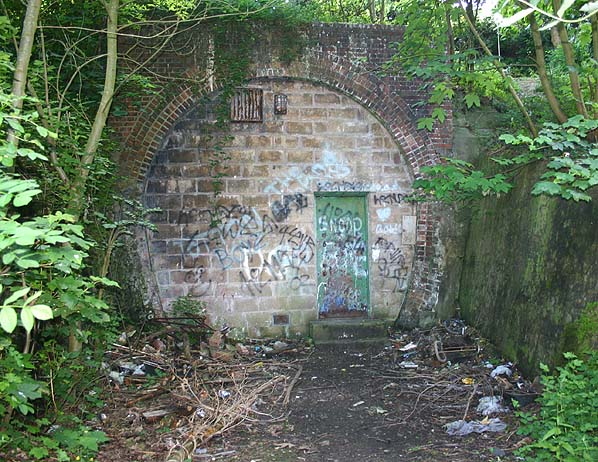
The image size is (598, 462). I want to click on top step, so click(x=347, y=324).